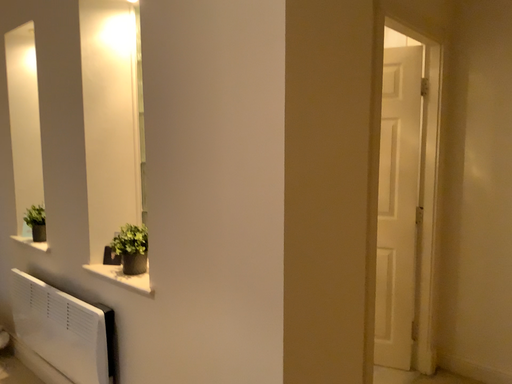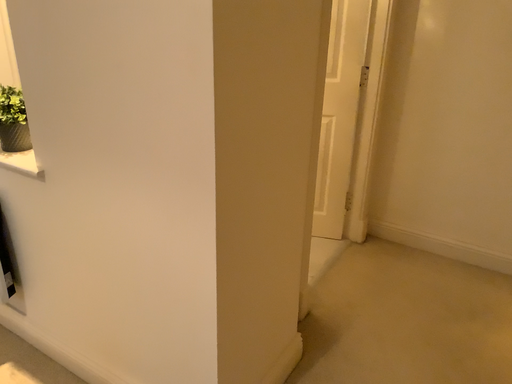
Question: Which way did the camera rotate in the video?

Choices:
 (A) rotated left
 (B) rotated right

Answer: (B)